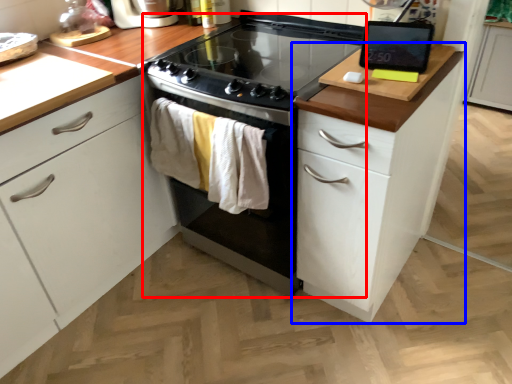
Question: Which point is closer to the camera, oven (highlighted by a red box) or cabinetry (highlighted by a blue box)?

Choices:
 (A) oven
 (B) cabinetry

Answer: (B)